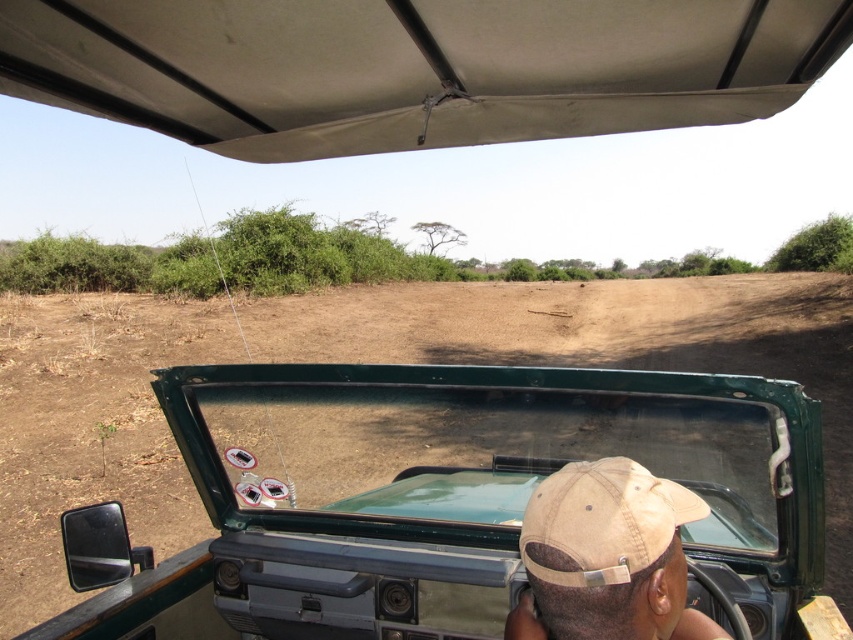
Is beige fabric canopy at upper center smaller than tan fabric baseball cap at center?

No, beige fabric canopy at upper center is not smaller than tan fabric baseball cap at center.

Locate an element on the screen. This screenshot has height=640, width=853. beige fabric canopy at upper center is located at coordinates (415, 67).

Does green matte vehicle at center have a lesser width compared to tan fabric baseball cap at center?

Indeed, green matte vehicle at center has a lesser width compared to tan fabric baseball cap at center.

The image size is (853, 640). In order to click on green matte vehicle at center in this screenshot , I will do `click(445, 499)`.

Between point (78, 524) and point (554, 508), which one is positioned in front?

Point (554, 508) is more forward.

Image resolution: width=853 pixels, height=640 pixels. I want to click on green matte vehicle at center, so click(445, 499).

Is green matte vehicle at center wider than beige fabric canopy at upper center?

In fact, green matte vehicle at center might be narrower than beige fabric canopy at upper center.

Is green matte vehicle at center positioned before beige fabric canopy at upper center?

Yes, green matte vehicle at center is closer to the viewer.

Find the location of a particular element. This screenshot has height=640, width=853. green matte vehicle at center is located at coordinates (445, 499).